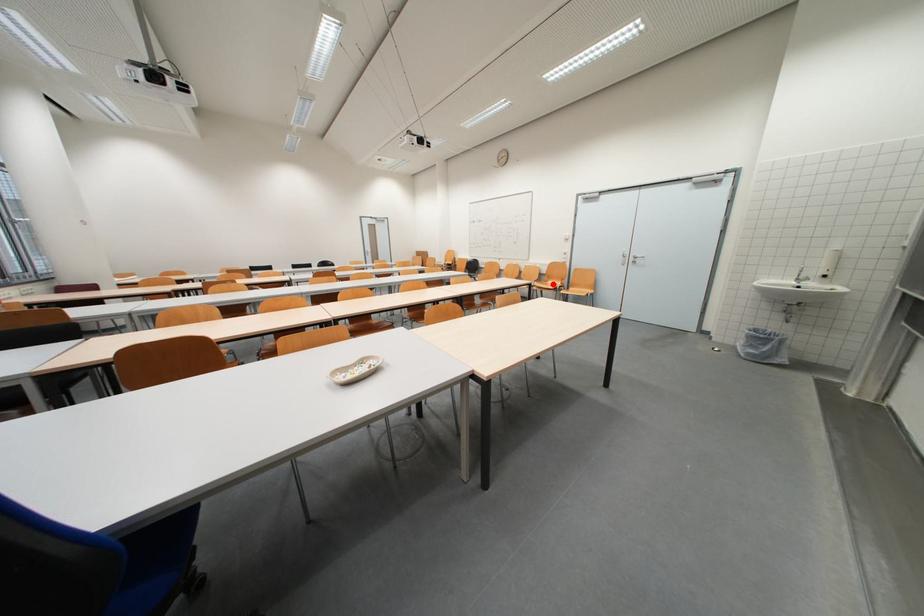
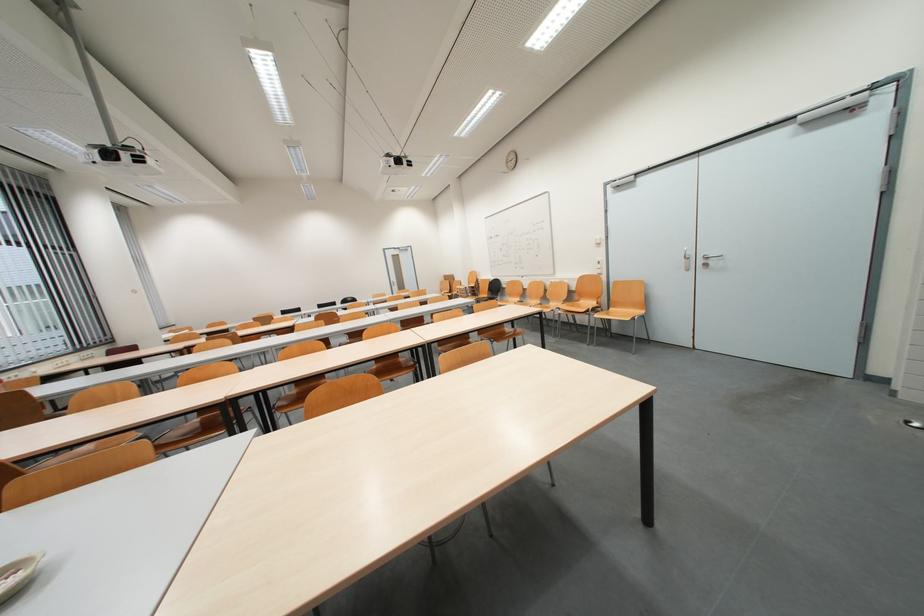
Find the pixel in the second image that matches the highlighted location in the first image.

(582, 302)